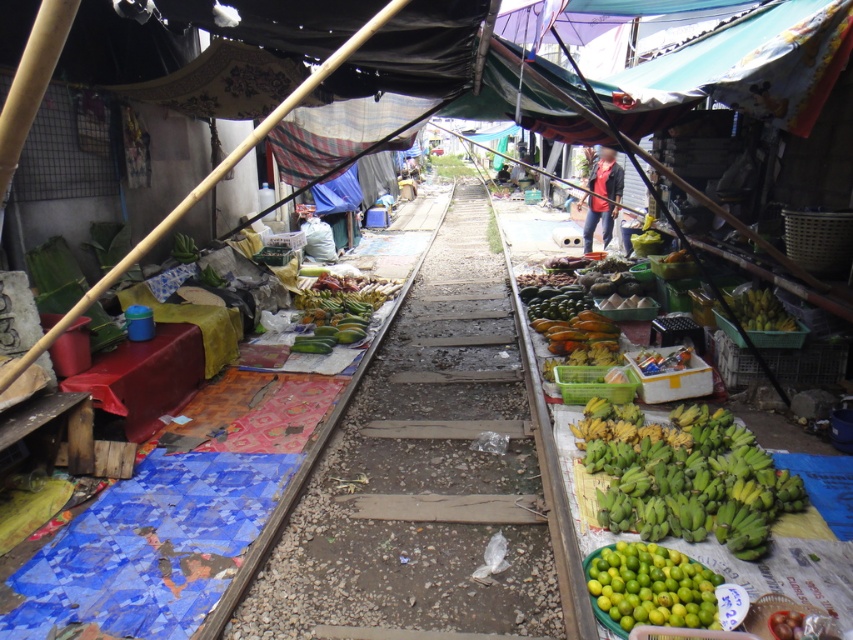
You are a customer in the market and want to buy limes. You see the green matte limes at lower right and the dark blue denim jacket at center. Which item is positioned lower in the image?

The green matte limes at lower right is located below the dark blue denim jacket at center, so the limes are positioned lower in the image.

You are a vendor at the market and want to place a new item between the dark blue denim jacket at center and the green fabric vendor at center. Which side should you choose to ensure there is enough space?

The dark blue denim jacket at center has a larger width than the green fabric vendor at center, so placing the new item on the side of the dark blue denim jacket at center would provide more space.